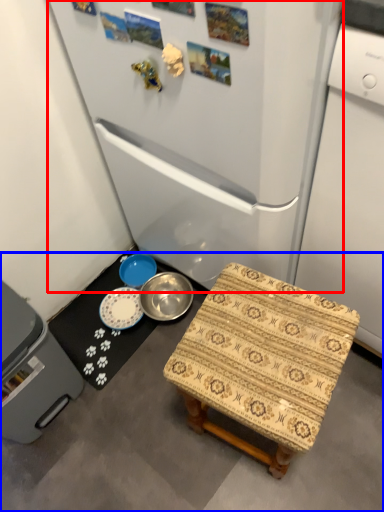
Question: Which object is closer to the camera taking this photo, refrigerator (highlighted by a red box) or concrete (highlighted by a blue box)?

Choices:
 (A) refrigerator
 (B) concrete

Answer: (A)